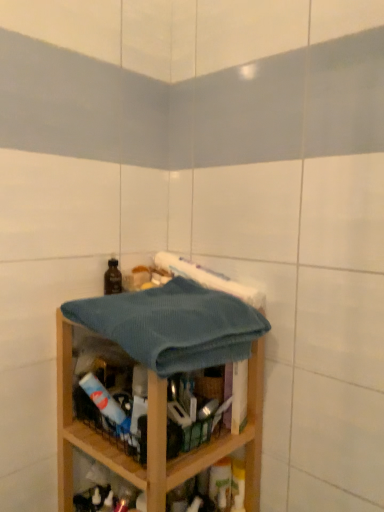
Question: Does brown matte bottle at upper left come in front of wooden shelf at center?

Choices:
 (A) yes
 (B) no

Answer: (B)

Question: Can you confirm if brown matte bottle at upper left is thinner than wooden shelf at center?

Choices:
 (A) no
 (B) yes

Answer: (B)

Question: Is brown matte bottle at upper left with wooden shelf at center?

Choices:
 (A) no
 (B) yes

Answer: (A)

Question: Is brown matte bottle at upper left aimed at wooden shelf at center?

Choices:
 (A) yes
 (B) no

Answer: (B)

Question: From a real-world perspective, is brown matte bottle at upper left on wooden shelf at center?

Choices:
 (A) no
 (B) yes

Answer: (B)

Question: Is brown matte bottle at upper left not inside wooden shelf at center?

Choices:
 (A) no
 (B) yes

Answer: (B)

Question: Is the position of brown matte bottle at upper left more distant than that of teal waffle towel at center?

Choices:
 (A) no
 (B) yes

Answer: (B)

Question: Is brown matte bottle at upper left taller than teal waffle towel at center?

Choices:
 (A) yes
 (B) no

Answer: (B)

Question: Is brown matte bottle at upper left in contact with teal waffle towel at center?

Choices:
 (A) yes
 (B) no

Answer: (B)

Question: Can you confirm if brown matte bottle at upper left is thinner than teal waffle towel at center?

Choices:
 (A) yes
 (B) no

Answer: (A)

Question: From a real-world perspective, is brown matte bottle at upper left under teal waffle towel at center?

Choices:
 (A) yes
 (B) no

Answer: (B)

Question: Could you tell me if brown matte bottle at upper left is facing teal waffle towel at center?

Choices:
 (A) yes
 (B) no

Answer: (B)

Question: Does wooden shelf at center have a smaller size compared to brown matte bottle at upper left?

Choices:
 (A) no
 (B) yes

Answer: (A)